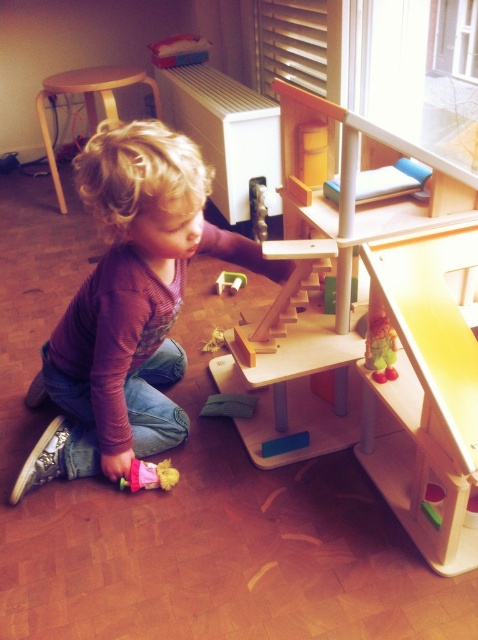
Is matte pink doll at lower left closer to camera compared to wooden block at center?

Yes, it is.

From the picture: Does matte pink doll at lower left appear over wooden block at center?

Incorrect, matte pink doll at lower left is not positioned above wooden block at center.

What do you see at coordinates (149, 476) in the screenshot?
I see `matte pink doll at lower left` at bounding box center [149, 476].

Identify the location of matte pink doll at lower left. The image size is (478, 640). (149, 476).

Who is shorter, purple soft shirt at lower left or light brown wooden stool at upper left?

light brown wooden stool at upper left is shorter.

Based on the photo, can you confirm if purple soft shirt at lower left is taller than light brown wooden stool at upper left?

Yes.

Find the location of `purple soft shirt at lower left`. purple soft shirt at lower left is located at coordinates (129, 305).

This screenshot has width=478, height=640. I want to click on purple soft shirt at lower left, so click(x=129, y=305).

Who is positioned more to the right, wooden doll at lower right or matte pink doll at lower left?

From the viewer's perspective, wooden doll at lower right appears more on the right side.

Which is more to the left, wooden doll at lower right or matte pink doll at lower left?

Positioned to the left is matte pink doll at lower left.

Does point (392, 368) come closer to viewer compared to point (150, 470)?

Yes, point (392, 368) is closer to viewer.

At what (x,y) coordinates should I click in order to perform the action: click on wooden doll at lower right. Please return your answer as a coordinate pair (x, y). The width and height of the screenshot is (478, 640). Looking at the image, I should click on (380, 342).